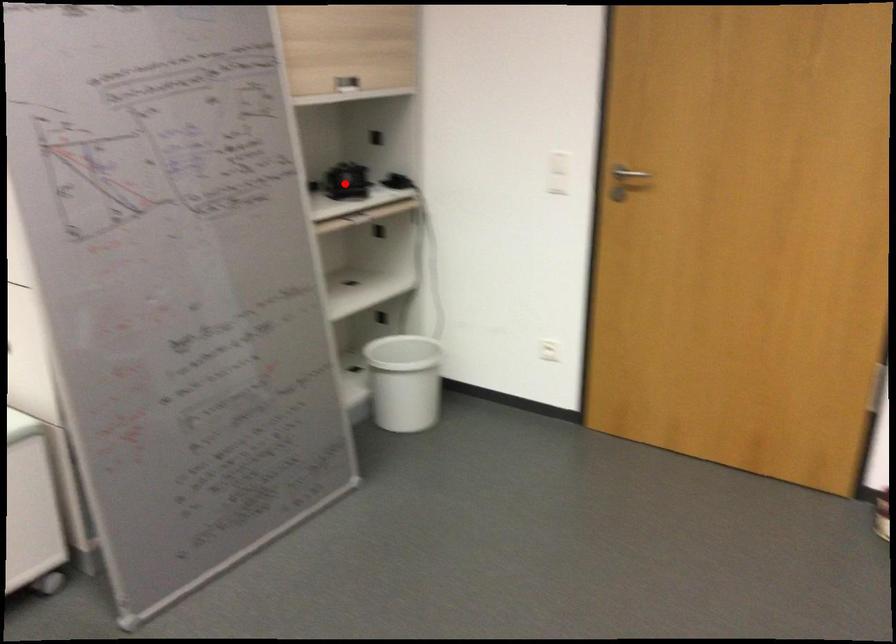
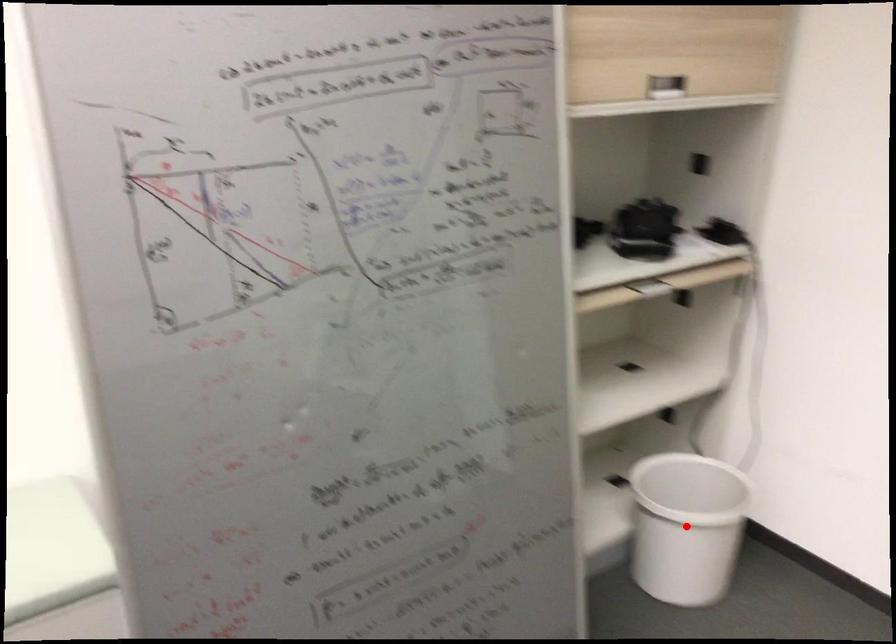
I am providing you with two images of the same scene from different viewpoints. A red point is marked on the first image and another point is marked on the second image. Do the highlighted points in image1 and image2 indicate the same real-world spot?

No